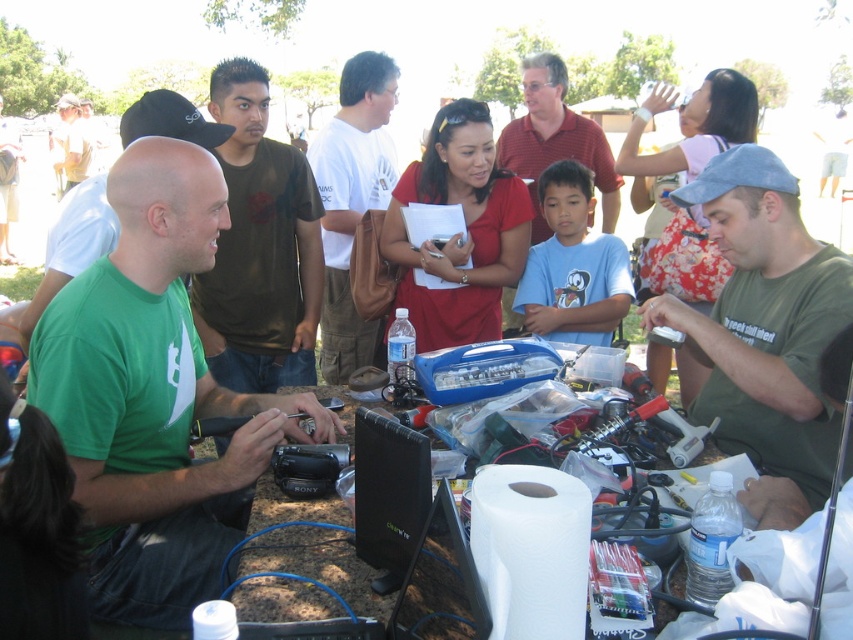
Can you confirm if green matte shirt at center is positioned above matte khaki shirt at upper left?

Actually, green matte shirt at center is below matte khaki shirt at upper left.

Between green matte shirt at center and matte khaki shirt at upper left, which one appears on the left side from the viewer's perspective?

matte khaki shirt at upper left is more to the left.

Who is more distant from viewer, [112,596] or [55,163]?

Positioned behind is point [55,163].

The width and height of the screenshot is (853, 640). In order to click on green matte shirt at center in this screenshot , I will do pyautogui.click(x=154, y=394).

Does white cotton shirt at center have a greater height compared to matte red polo shirt at center?

Yes, white cotton shirt at center is taller than matte red polo shirt at center.

Is white cotton shirt at center further to the viewer compared to matte red polo shirt at center?

No.

Identify the location of white cotton shirt at center. This screenshot has height=640, width=853. (352, 202).

Can you confirm if white paper towel at lower center is positioned to the right of matte red polo shirt at center?

Incorrect, white paper towel at lower center is not on the right side of matte red polo shirt at center.

Which is in front, point (489, 490) or point (607, 220)?

Positioned in front is point (489, 490).

You are a GUI agent. You are given a task and a screenshot of the screen. Output one action in this format:
    pyautogui.click(x=<x>, y=<y>)
    Task: Click on the white paper towel at lower center
    This screenshot has height=640, width=853.
    Given the screenshot: What is the action you would take?
    pyautogui.click(x=531, y=548)